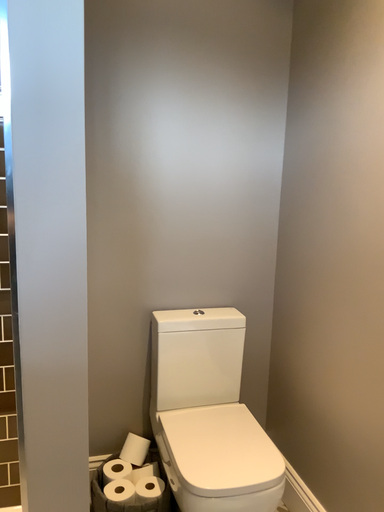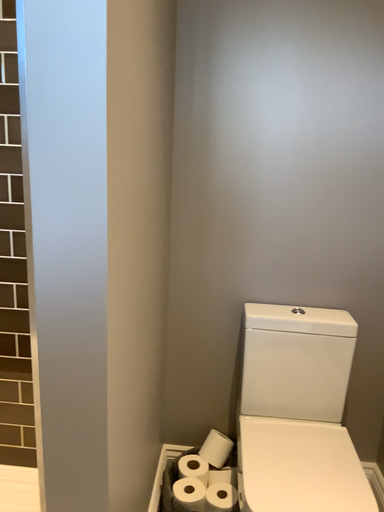
Question: Which way did the camera rotate in the video?

Choices:
 (A) rotated right
 (B) rotated left

Answer: (B)